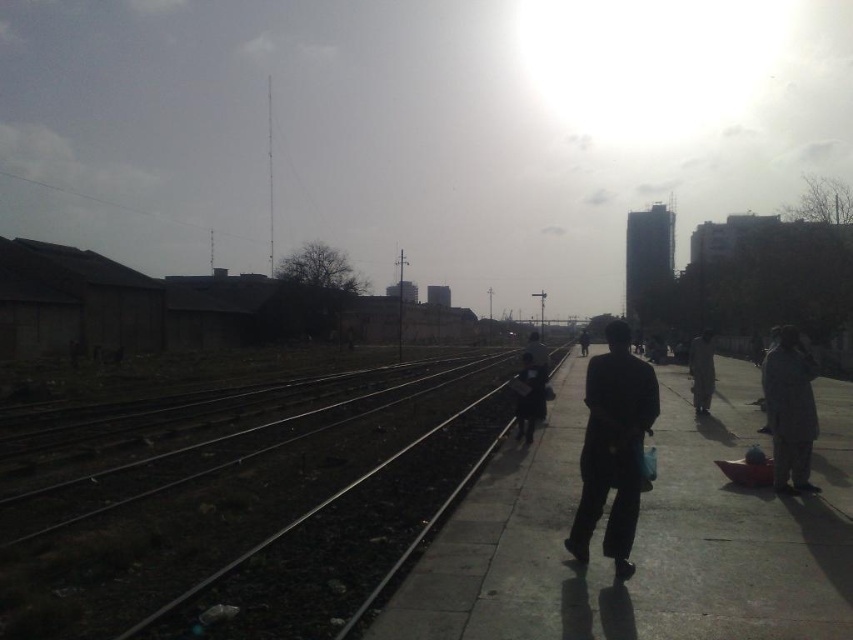
You are a commuter waiting on the platform and see the dark concrete pavement at center and the dark gray fabric coat at right. Which object is positioned to the left of the other?

The dark concrete pavement at center is to the left of the dark gray fabric coat at right.

You are a traveler standing on the platform and see the black metal train track at left and the black fabric jacket at center. Which object is located to the left of the other?

The black metal train track at left is positioned on the left side of black fabric jacket at center.

You are standing at the center of the platform and want to walk to the black metal train track at left. Which direction should you face to walk directly towards it?

You should face towards the left direction to walk directly towards the black metal train track at left since it is located at the left side of the platform.